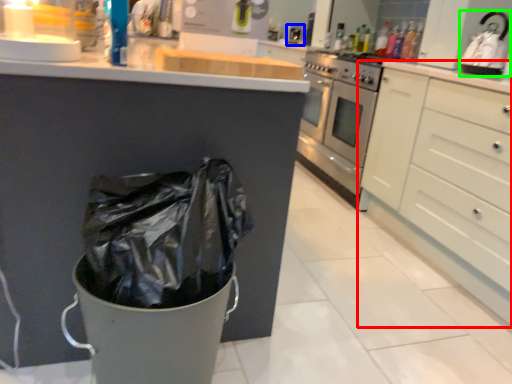
Question: Estimate the real-world distances between objects in this image. Which object is closer to cabinetry (highlighted by a red box), sink (highlighted by a blue box) or appliance (highlighted by a green box)?

Choices:
 (A) sink
 (B) appliance

Answer: (B)